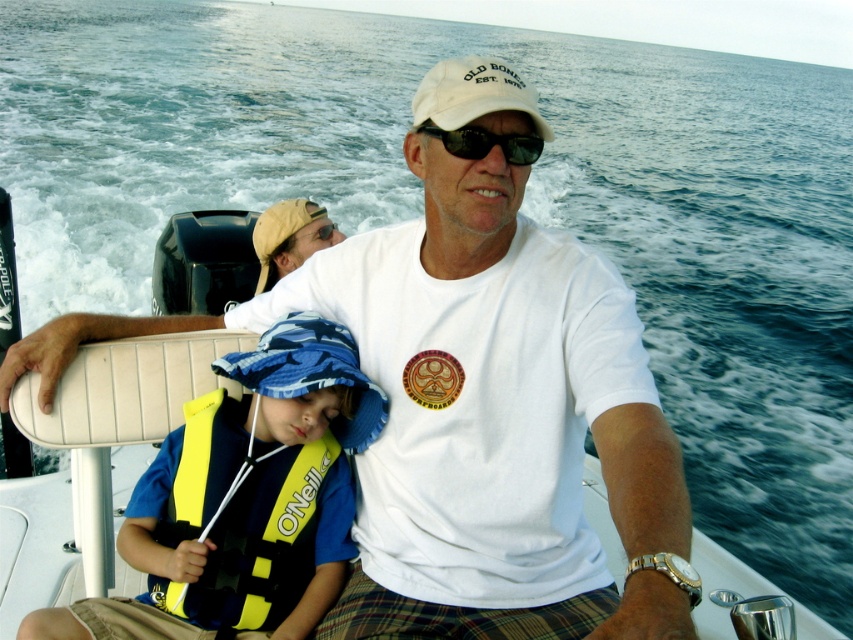
Which is above, white fabric baseball cap at center or black plastic sunglasses at center?

Positioned higher is white fabric baseball cap at center.

Who is taller, white fabric baseball cap at center or black plastic sunglasses at center?

white fabric baseball cap at center is taller.

What do you see at coordinates (473, 93) in the screenshot? I see `white fabric baseball cap at center` at bounding box center [473, 93].

Find the location of `white fabric baseball cap at center`. white fabric baseball cap at center is located at coordinates (473, 93).

Between yellow life vest at center and yellow fabric life jacket at lower left, which one appears on the right side from the viewer's perspective?

Positioned to the right is yellow life vest at center.

Does yellow life vest at center appear over yellow fabric life jacket at lower left?

Correct, yellow life vest at center is located above yellow fabric life jacket at lower left.

The image size is (853, 640). What do you see at coordinates (248, 493) in the screenshot? I see `yellow life vest at center` at bounding box center [248, 493].

Locate an element on the screen. The image size is (853, 640). yellow life vest at center is located at coordinates (248, 493).

Who is more distant from viewer, (305, 532) or (270, 284)?

Point (270, 284)

Image resolution: width=853 pixels, height=640 pixels. What are the coordinates of `yellow fabric life jacket at lower left` in the screenshot? It's located at (244, 515).